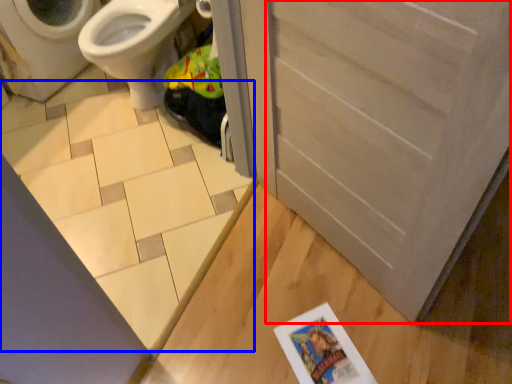
Question: Among these objects, which one is farthest to the camera, screen door (highlighted by a red box) or tile (highlighted by a blue box)?

Choices:
 (A) screen door
 (B) tile

Answer: (B)